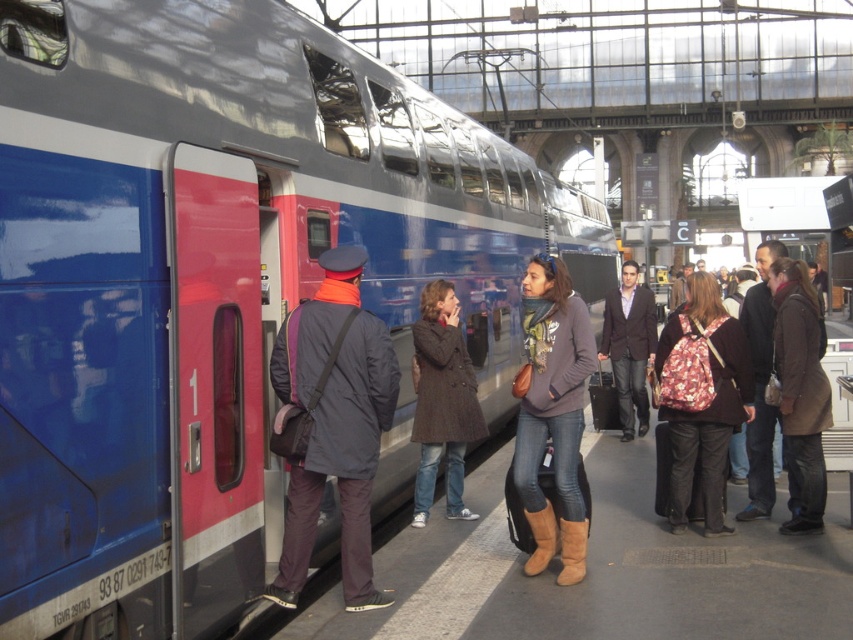
Does brown wool coat at center have a greater width compared to dark brown leather jacket at center?

Correct, the width of brown wool coat at center exceeds that of dark brown leather jacket at center.

Is brown wool coat at center taller than dark brown leather jacket at center?

Correct, brown wool coat at center is much taller as dark brown leather jacket at center.

Describe the element at coordinates (442, 401) in the screenshot. This screenshot has width=853, height=640. I see `brown wool coat at center` at that location.

Find the location of `brown wool coat at center`. brown wool coat at center is located at coordinates (442, 401).

Can you confirm if brown leather jacket at center is bigger than dark brown leather jacket at center?

Actually, brown leather jacket at center might be smaller than dark brown leather jacket at center.

Measure the distance between brown leather jacket at center and camera.

The distance of brown leather jacket at center from camera is 5.83 meters.

This screenshot has width=853, height=640. I want to click on brown leather jacket at center, so click(759, 385).

Does metallic blue train at center appear on the right side of floral fabric backpack at center-right?

Incorrect, metallic blue train at center is not on the right side of floral fabric backpack at center-right.

Can you confirm if metallic blue train at center is positioned above floral fabric backpack at center-right?

Yes, metallic blue train at center is above floral fabric backpack at center-right.

Between point (532, 227) and point (720, 316), which one is positioned behind?

The point (532, 227) is behind.

Locate an element on the screen. metallic blue train at center is located at coordinates (216, 285).